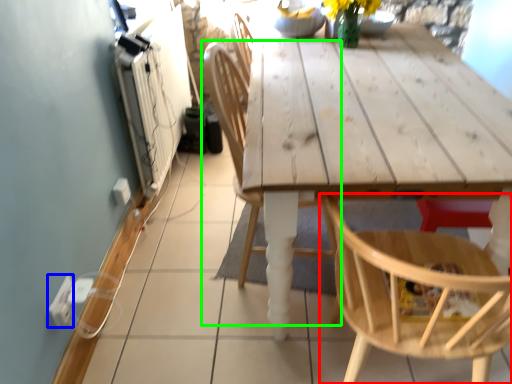
Question: Which object is positioned closest to chair (highlighted by a red box)? Select from electric outlet (highlighted by a blue box) and chair (highlighted by a green box).

Choices:
 (A) electric outlet
 (B) chair

Answer: (B)